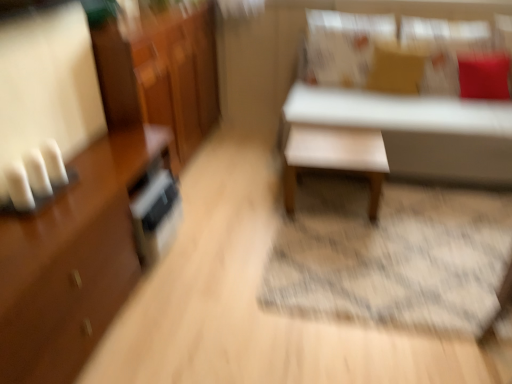
This screenshot has width=512, height=384. I want to click on vacant region to the right of brown glossy cabinet at left, so click(223, 300).